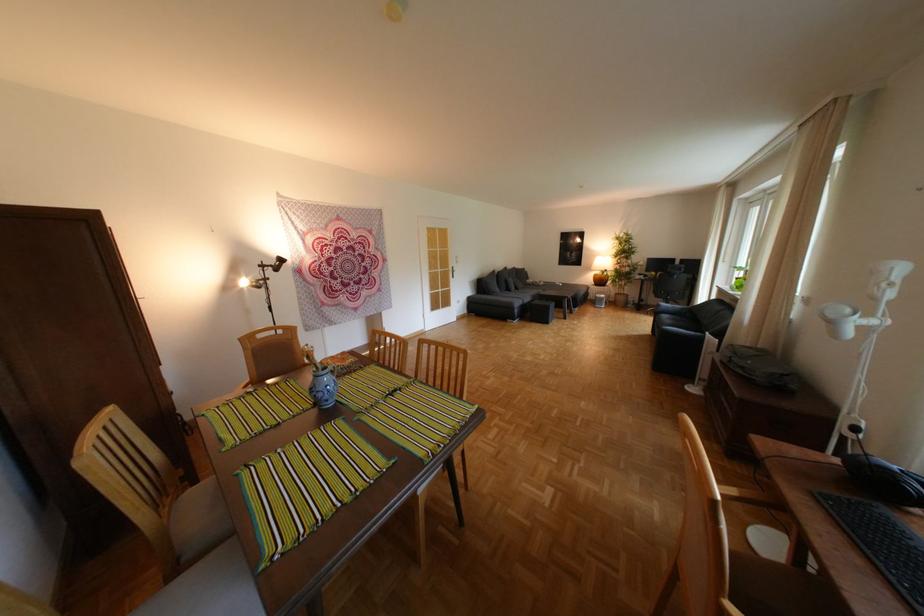
What do you see at coordinates (541, 310) in the screenshot? I see `the black footstool` at bounding box center [541, 310].